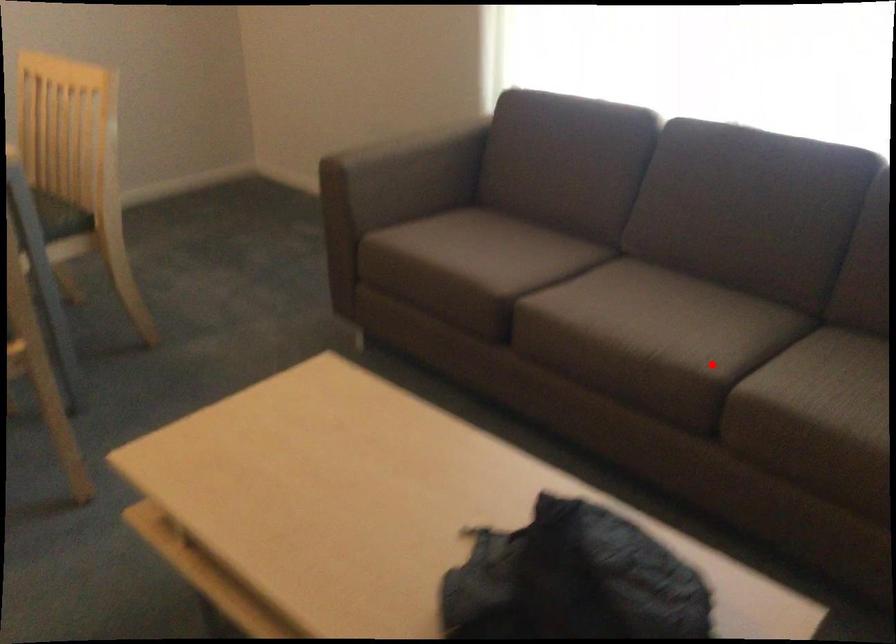
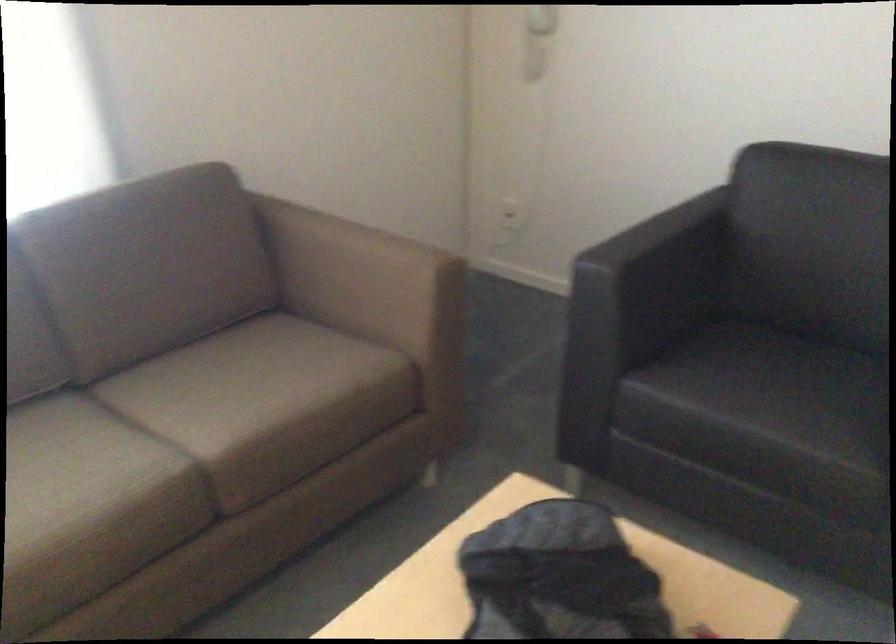
Question: A red point is marked in image1. In image2, is the corresponding 3D point closer to the camera or farther? Reply with the corresponding letter.

Choices:
 (A) The corresponding 3D point is closer.
 (B) The corresponding 3D point is farther.

Answer: (A)